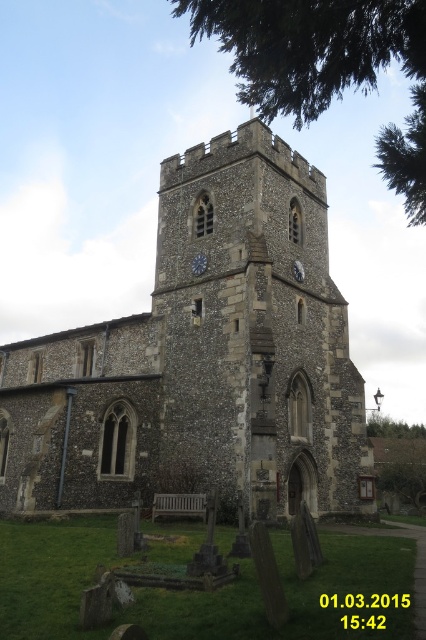
Can you confirm if stone church at center is bigger than blue metallic clock at center?

Indeed, stone church at center has a larger size compared to blue metallic clock at center.

Is stone church at center further to camera compared to blue metallic clock at center?

No, it is in front of blue metallic clock at center.

Is point (308, 490) farther from camera compared to point (204, 262)?

No, (308, 490) is in front of (204, 262).

You are a GUI agent. You are given a task and a screenshot of the screen. Output one action in this format:
    pyautogui.click(x=<x>, y=<y>)
    Task: Click on the stone church at center
    The height and width of the screenshot is (640, 426).
    Given the screenshot: What is the action you would take?
    pyautogui.click(x=204, y=358)

How much distance is there between green leafy tree at upper center and blue metallic clock at center?

They are 192.95 feet apart.

Between green leafy tree at upper center and blue metallic clock at center, which one is positioned lower?

Positioned lower is blue metallic clock at center.

Between point (305, 52) and point (201, 260), which one is positioned behind?

The point (201, 260) is behind.

Locate an element on the screen. This screenshot has height=640, width=426. green leafy tree at upper center is located at coordinates (325, 67).

Which is in front, point (192, 285) or point (397, 483)?

Positioned in front is point (192, 285).

This screenshot has height=640, width=426. What are the coordinates of `stone church at center` in the screenshot? It's located at (204, 358).